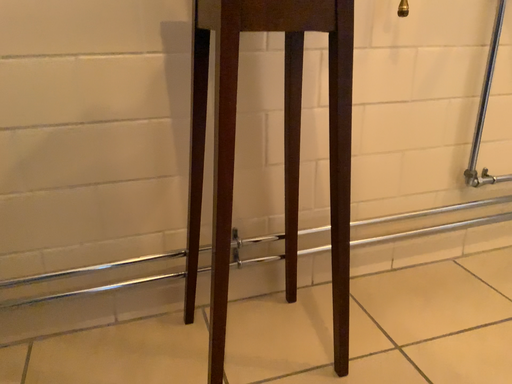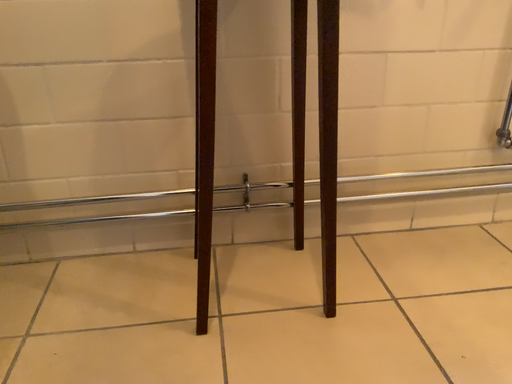
Question: Which way did the camera rotate in the video?

Choices:
 (A) rotated right
 (B) rotated left

Answer: (B)